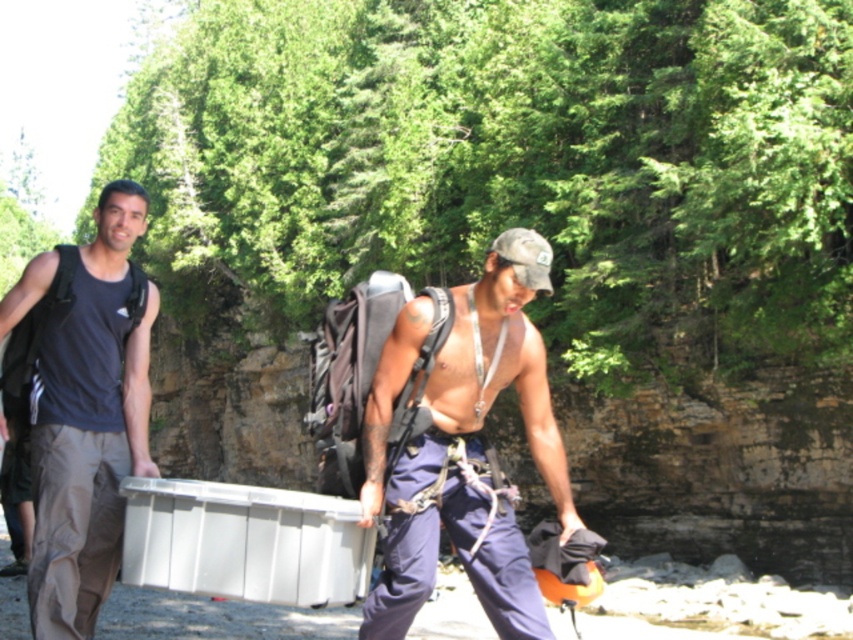
You are a photographer trying to capture a clear shot of both the shiny blue pants at center and the matte gray tank top at left. Which one is positioned higher in the frame?

The shiny blue pants at center is above the matte gray tank top at left, so it is positioned higher in the frame.

From the picture: You are a photographer trying to capture both the shiny blue pants at center and the matte gray tank top at left in the same frame. Based on their positions, which one should you focus on first to ensure both are in the shot?

You should focus on the shiny blue pants at center first since it is positioned on the right side of the matte gray tank top at left, meaning it is closer to the right edge of the frame. By centering your focus on the shiny blue pants at center, you can adjust the camera to include both objects without one being cut off.

You are a photographer trying to capture both the shiny blue pants at center and the matte gray tank top at left in the same frame. Which object should you focus on first if you want to ensure both are in focus?

You should focus on the matte gray tank top at left first because it is taller than the shiny blue pants at center, allowing the depth of field to cover both objects more effectively.